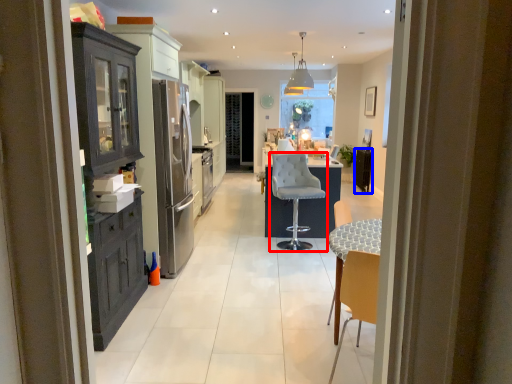
Question: Which object is closer to the camera taking this photo, chair (highlighted by a red box) or appliance (highlighted by a blue box)?

Choices:
 (A) chair
 (B) appliance

Answer: (A)